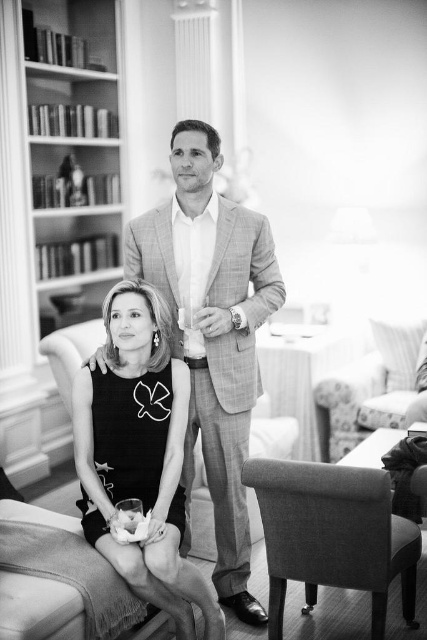
Question: Does plaid fabric suit at center have a larger size compared to soft fabric armchair at lower right?

Choices:
 (A) no
 (B) yes

Answer: (B)

Question: Which point is farther to the camera?

Choices:
 (A) wooden bookshelf at left
 (B) black fabric armchair at lower left
 (C) floral fabric armchair at right
 (D) soft fabric armchair at lower right

Answer: (A)

Question: Which point is farther to the camera?

Choices:
 (A) floral fabric armchair at right
 (B) plaid fabric suit at center
 (C) soft fabric armchair at lower right

Answer: (A)

Question: Can you confirm if plaid fabric suit at center is positioned below matte black dress at center?

Choices:
 (A) yes
 (B) no

Answer: (B)

Question: Can you confirm if matte black dress at center is wider than floral fabric armchair at right?

Choices:
 (A) no
 (B) yes

Answer: (A)

Question: Which point is farther to the camera?

Choices:
 (A) black fabric armchair at lower left
 (B) soft fabric armchair at lower right
 (C) matte black dress at center
 (D) floral fabric armchair at right

Answer: (D)